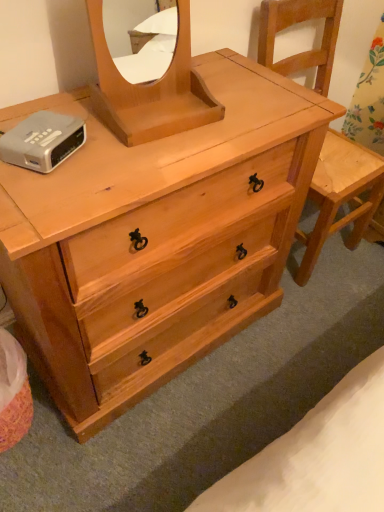
At what (x,y) coordinates should I click in order to perform the action: click on free space to the back side of silver metallic alarm clock at upper left. Please return your answer as a coordinate pair (x, y). Looking at the image, I should click on (75, 110).